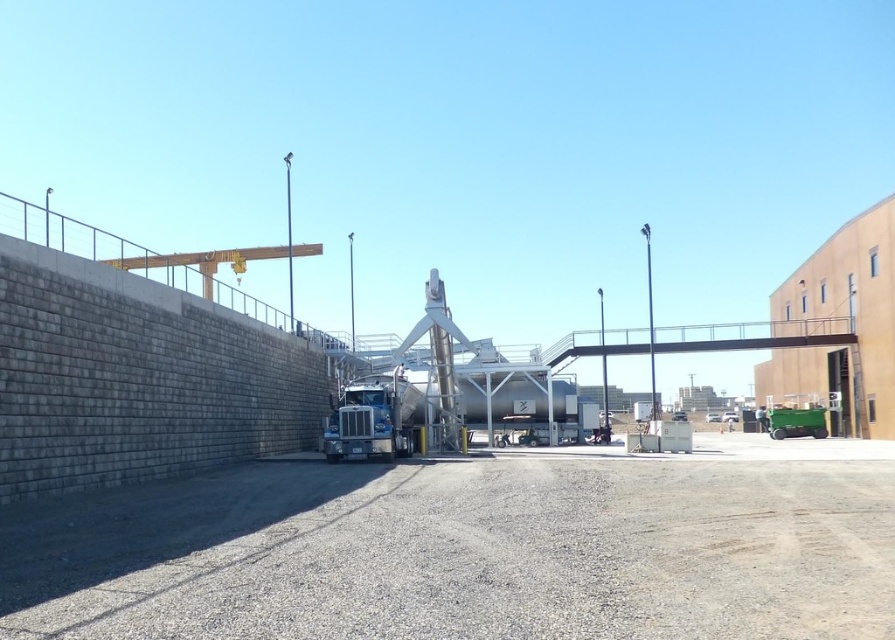
The image size is (895, 640). What do you see at coordinates (473, 548) in the screenshot? I see `gray concrete wall at left` at bounding box center [473, 548].

Is gray concrete wall at left to the left of silver metallic trailer truck at center from the viewer's perspective?

No, gray concrete wall at left is not to the left of silver metallic trailer truck at center.

Is point (465, 611) positioned after point (405, 412)?

No, (465, 611) is in front of (405, 412).

Locate an element on the screen. gray concrete wall at left is located at coordinates (473, 548).